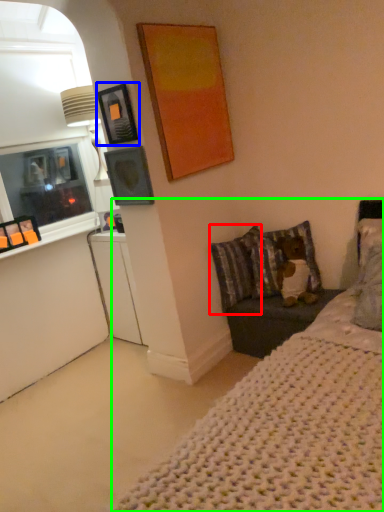
Question: Considering the real-world distances, which object is closest to pillow (highlighted by a red box)? picture frame (highlighted by a blue box) or bed (highlighted by a green box).

Choices:
 (A) picture frame
 (B) bed

Answer: (A)